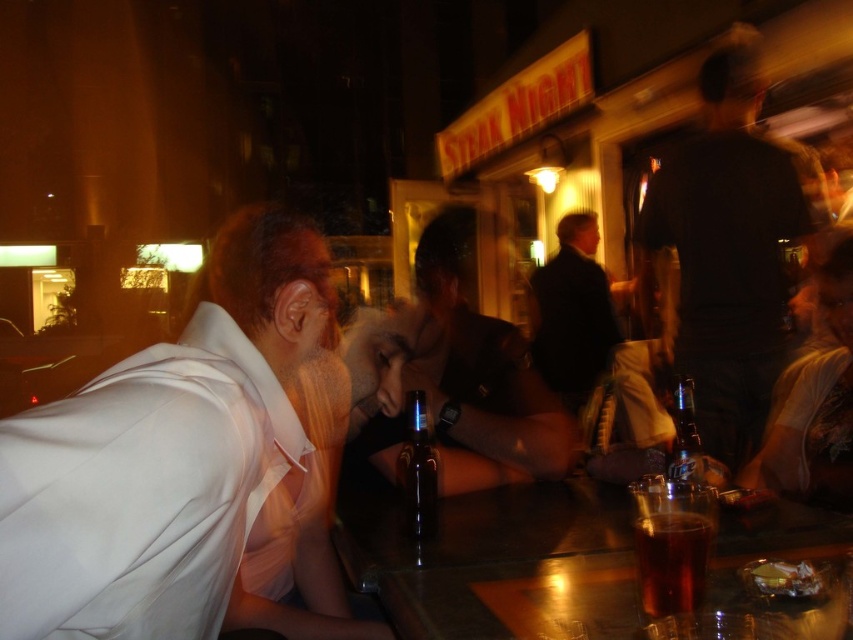
You are standing at the entrance of the bar and want to find the person wearing the white cotton shirt at left. Based on the coordinates provided, in which direction should you look to locate them?

The white cotton shirt at left is located at coordinates point (172,451), which means you should look towards the upper right direction from your current position at the entrance.

You are a bartender at the bar. You need to place a new drink order on the counter between the matte black shirt at center and the clear glass bottle at center. Considering their sizes, which object should you place the drink closer to?

The matte black shirt at center is larger than the clear glass bottle at center, so you should place the new drink closer to the clear glass bottle at center to avoid blocking the shirt wearer.

Based on the photo, you are a server at the bar and need to deliver a drink to the customer seated near the translucent glass cup at bar. Based on the scene description, where exactly should you place the drink?

The translucent glass cup at bar is located at point (672, 561), so you should place the drink near that coordinate to reach the customer.